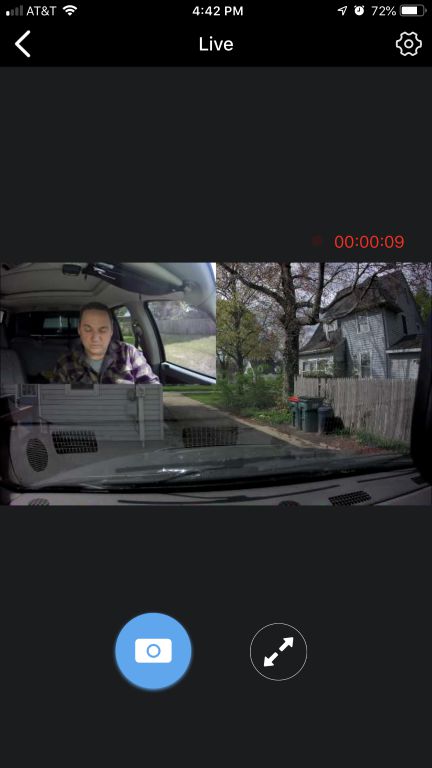
This screenshot has width=432, height=768. I want to click on vent, so click(x=76, y=442), click(x=199, y=439), click(x=358, y=497), click(x=292, y=502), click(x=34, y=454), click(x=41, y=500), click(x=420, y=477).